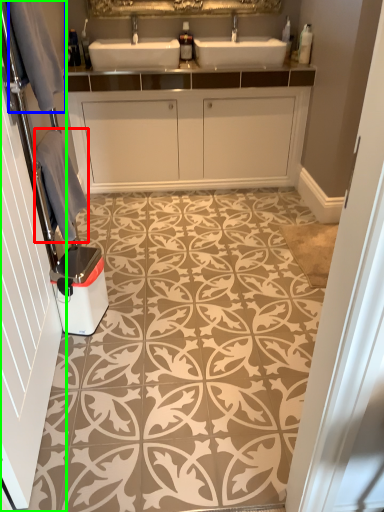
Question: Considering the real-world distances, which object is farthest from material (highlighted by a red box)? gray (highlighted by a blue box) or door (highlighted by a green box)?

Choices:
 (A) gray
 (B) door

Answer: (B)